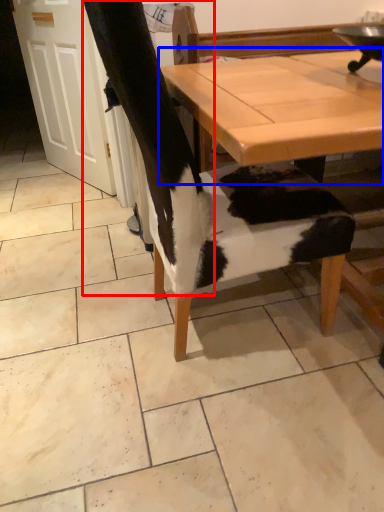
Question: Which of the following is the closest to the observer, leg (highlighted by a red box) or table (highlighted by a blue box)?

Choices:
 (A) leg
 (B) table

Answer: (B)